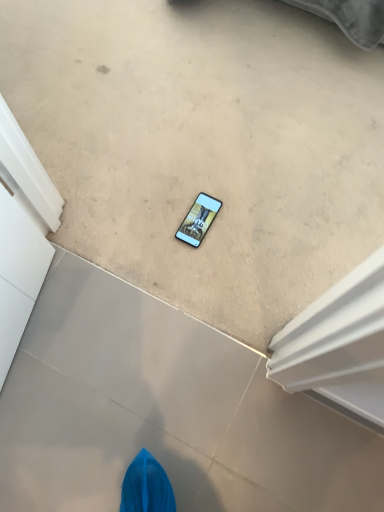
I want to click on vacant space to the right of matte black phone at center, so click(x=254, y=226).